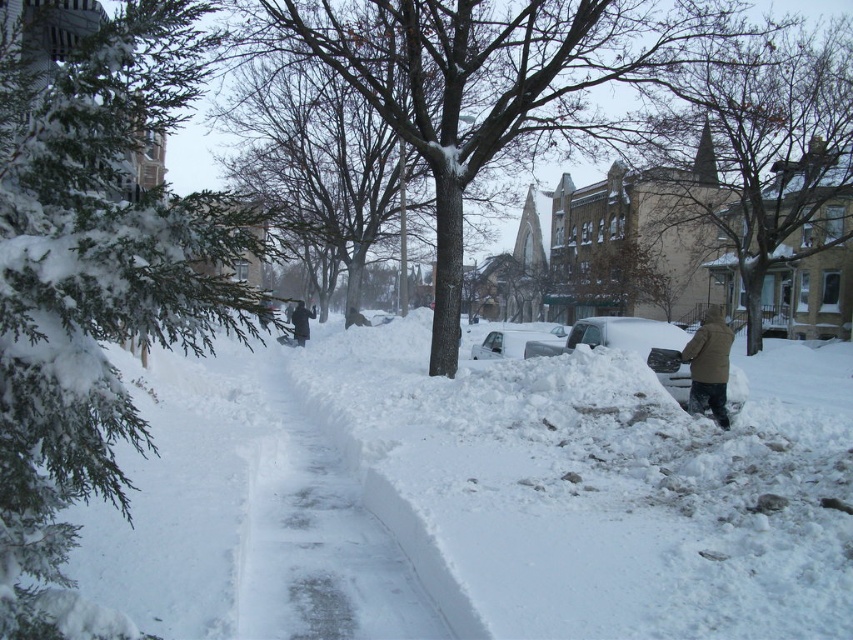
Question: Estimate the real-world distances between objects in this image. Which object is closer to the snow-covered tree at center?

Choices:
 (A) black fabric coat at center
 (B) brown fuzzy coat at lower right
 (C) bare branches at upper center
 (D) brown/dry bark tree at center

Answer: (C)

Question: Which point is farther to the camera?

Choices:
 (A) green textured evergreen at left
 (B) brown/dry bark tree at center
 (C) black fabric coat at center
 (D) brown fuzzy coat at lower right

Answer: (C)

Question: Which of these objects is positioned closest to the brown fuzzy coat at lower right?

Choices:
 (A) brown/dry bark tree at center
 (B) snow-covered tree at center
 (C) black fabric coat at center
 (D) bare branches at upper center

Answer: (B)

Question: Is snow-covered tree at center above bare branches at upper center?

Choices:
 (A) no
 (B) yes

Answer: (B)

Question: Does bare branches at upper center appear over brown fuzzy coat at lower right?

Choices:
 (A) yes
 (B) no

Answer: (A)

Question: Is brown fuzzy coat at lower right below black fabric coat at center?

Choices:
 (A) no
 (B) yes

Answer: (B)